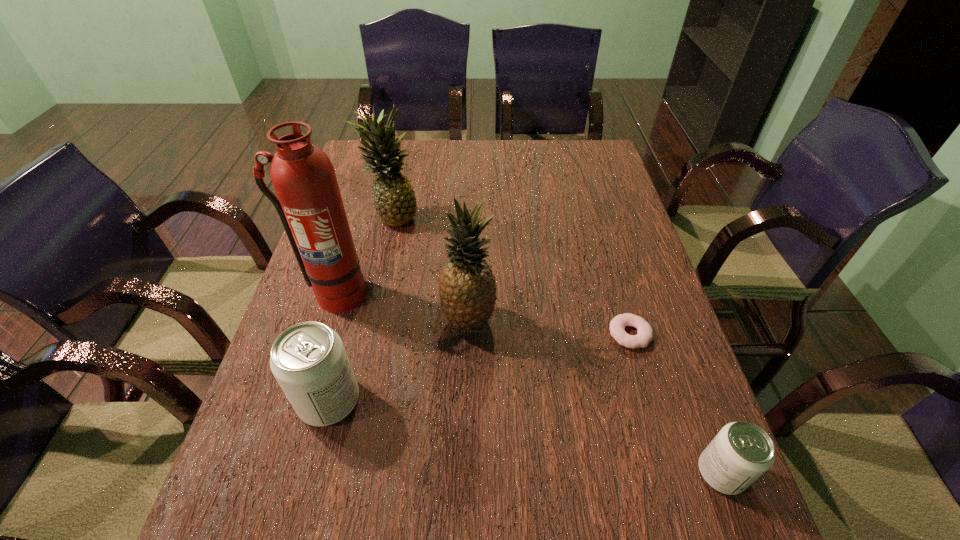
This screenshot has height=540, width=960. Identify the location of the tallest object. (309, 204).

Where is `free space located 0.070m on the right of the third shortest object`? free space located 0.070m on the right of the third shortest object is located at coordinates (395, 401).

Where is `vacant position located 0.090m on the left of the shorter soda can`? This screenshot has width=960, height=540. vacant position located 0.090m on the left of the shorter soda can is located at coordinates (649, 472).

At what (x,y) coordinates should I click in order to perform the action: click on blank area located 0.300m on the front of the farther pineapple. Please return your answer as a coordinate pair (x, y). The image size is (960, 540). Looking at the image, I should click on (372, 313).

Locate an element on the screen. free space located on the left of the shortest object is located at coordinates (471, 334).

Where is `free space located on the left of the nearer pineapple`? free space located on the left of the nearer pineapple is located at coordinates (377, 320).

Identify the location of vacant space located 0.210m on the label side of the tallest object. This screenshot has height=540, width=960. (305, 391).

I want to click on object that is at the near edge, so click(741, 452).

Find the location of a particular element. This screenshot has height=540, width=960. soda can that is at the left edge is located at coordinates (309, 361).

You are a GUI agent. You are given a task and a screenshot of the screen. Output one action in this format:
    pyautogui.click(x=<x>, y=<y>)
    Task: Click on the pineapple that is at the left edge
    
    Given the screenshot: What is the action you would take?
    pyautogui.click(x=394, y=200)